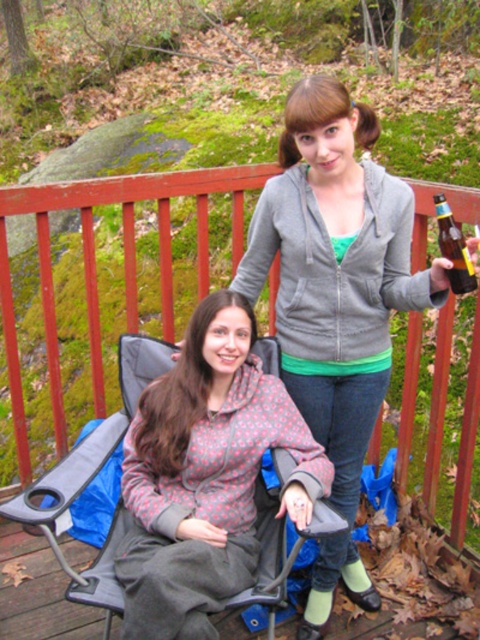
Where is `floral-patterned hoodie at center`? Image resolution: width=480 pixels, height=640 pixels. floral-patterned hoodie at center is located at coordinates (205, 476).

Between floral-patterned hoodie at center and printed cotton shirt at center, which one is positioned lower?

floral-patterned hoodie at center

The width and height of the screenshot is (480, 640). I want to click on floral-patterned hoodie at center, so click(x=205, y=476).

Find the location of a particular element. floral-patterned hoodie at center is located at coordinates 205,476.

Who is positioned more to the right, floral-patterned hoodie at center or matte gray hoodie at upper center?

From the viewer's perspective, matte gray hoodie at upper center appears more on the right side.

Find the location of a particular element. This screenshot has height=640, width=480. floral-patterned hoodie at center is located at coordinates (205, 476).

Is point (132, 538) closer to camera compared to point (288, 109)?

That is False.

The width and height of the screenshot is (480, 640). In order to click on floral-patterned hoodie at center in this screenshot , I will do `click(205, 476)`.

Describe the element at coordinates (182, 390) in the screenshot. The image size is (480, 640). I see `printed cotton shirt at center` at that location.

Does printed cotton shirt at center appear over matte gray hoodie at upper center?

No, printed cotton shirt at center is not above matte gray hoodie at upper center.

Between point (181, 429) and point (300, 81), which one is positioned in front?

Point (300, 81) is in front.

At what (x,y) coordinates should I click in order to perform the action: click on printed cotton shirt at center. Please return your answer as a coordinate pair (x, y). Looking at the image, I should click on (182, 390).